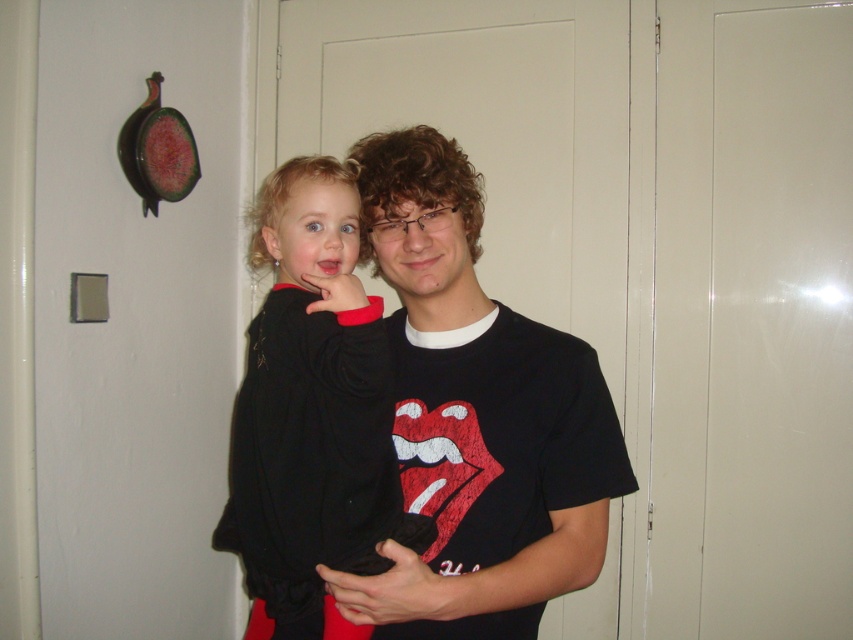
Question: Among these objects, which one is farthest from the camera?

Choices:
 (A) black cotton t-shirt at center
 (B) black fleece sweater at center

Answer: (B)

Question: Which of the following is the farthest from the observer?

Choices:
 (A) (328, 488)
 (B) (474, 544)

Answer: (B)

Question: Is black cotton t-shirt at center above black fleece sweater at center?

Choices:
 (A) no
 (B) yes

Answer: (B)

Question: Which of the following is the closest to the observer?

Choices:
 (A) black fleece sweater at center
 (B) black cotton t-shirt at center

Answer: (B)

Question: Does black cotton t-shirt at center appear under black fleece sweater at center?

Choices:
 (A) no
 (B) yes

Answer: (A)

Question: Does black cotton t-shirt at center have a larger size compared to black fleece sweater at center?

Choices:
 (A) yes
 (B) no

Answer: (A)